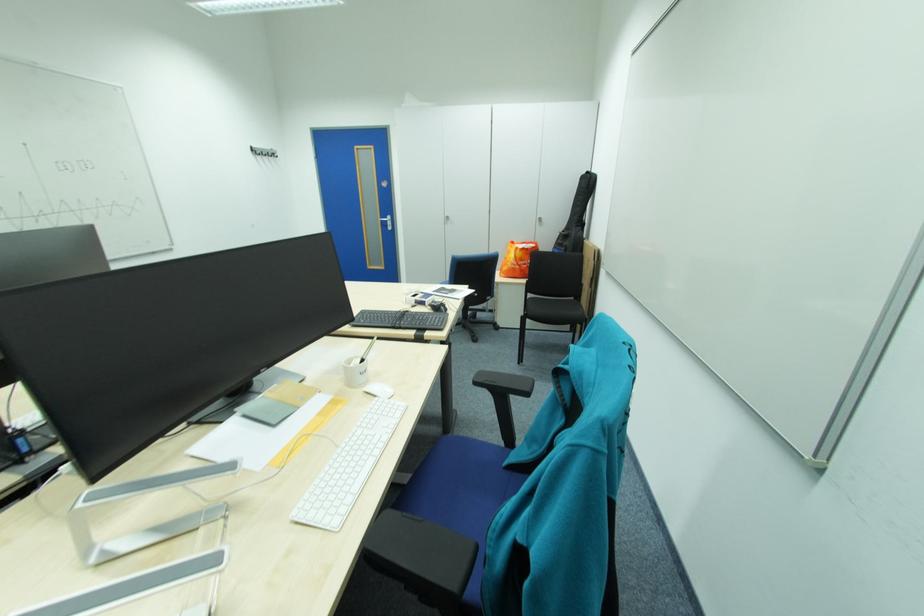
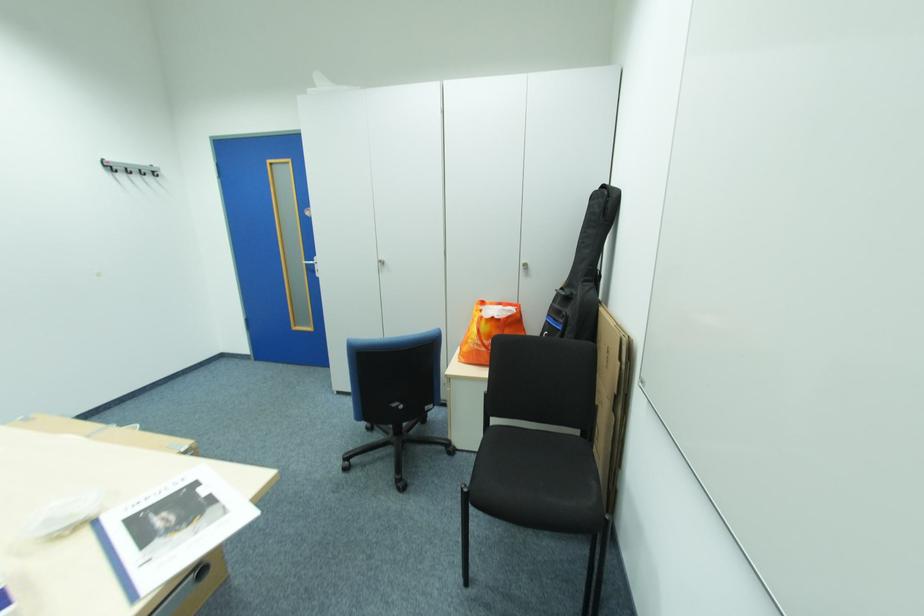
The point at (x=443, y=292) is marked in the first image. Where is the corresponding point in the second image?

(140, 521)